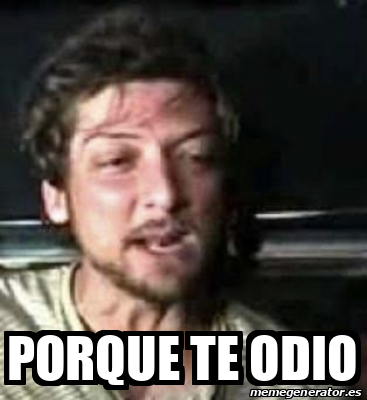
In order to click on blackboard in this screenshot , I will do `click(314, 118)`.